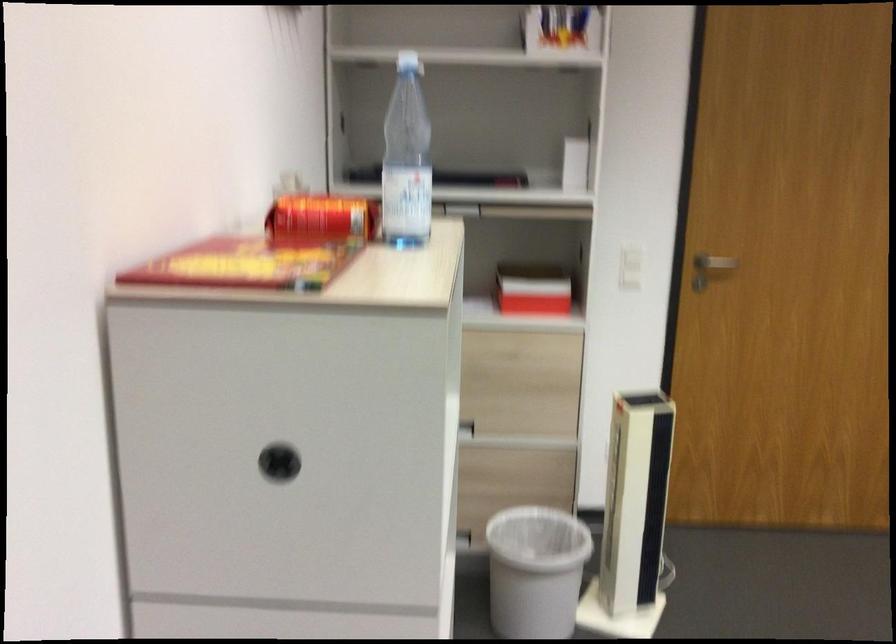
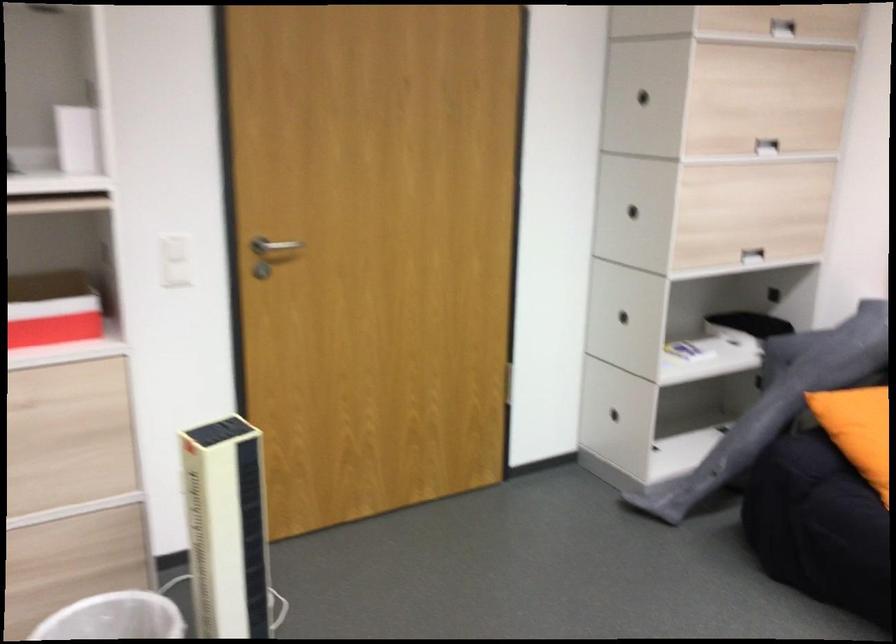
Question: The camera is either moving clockwise (left) or counter-clockwise (right) around the object. The first image is from the beginning of the video and the second image is from the end. Is the camera moving left or right when shooting the video?

Choices:
 (A) Left
 (B) Right

Answer: (A)